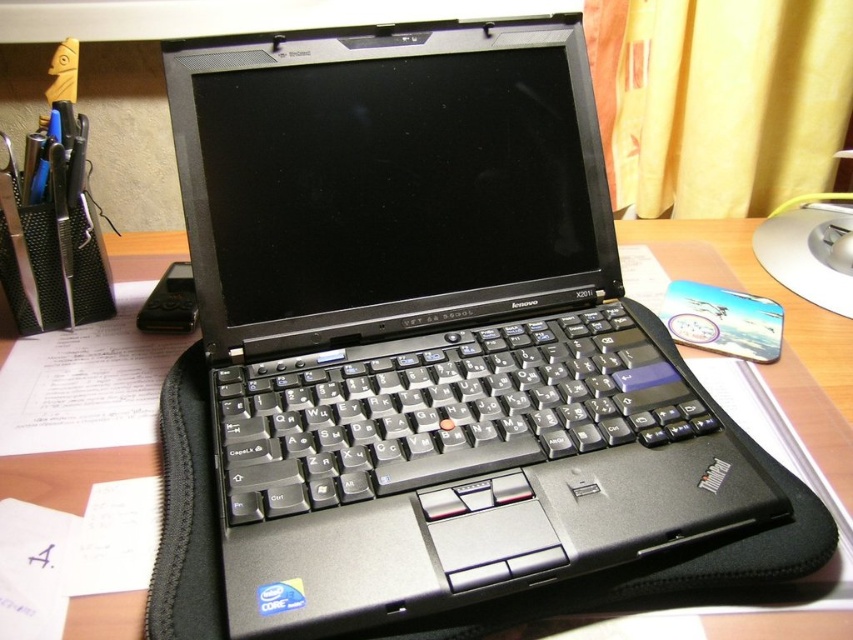
Question: Which of the following is the closest to the observer?

Choices:
 (A) (216, 392)
 (B) (509, 349)

Answer: (A)

Question: Can you confirm if black matte laptop at center is wider than black plastic keyboard at center?

Choices:
 (A) no
 (B) yes

Answer: (B)

Question: Observing the image, what is the correct spatial positioning of black matte laptop at center in reference to black plastic keyboard at center?

Choices:
 (A) below
 (B) above

Answer: (B)

Question: Can you confirm if black matte laptop at center is positioned to the right of black plastic keyboard at center?

Choices:
 (A) yes
 (B) no

Answer: (B)